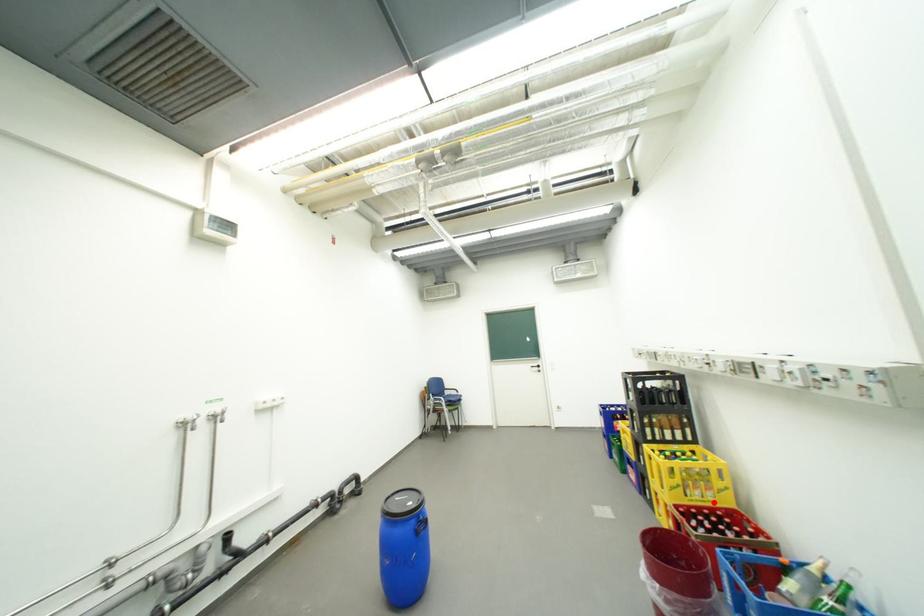
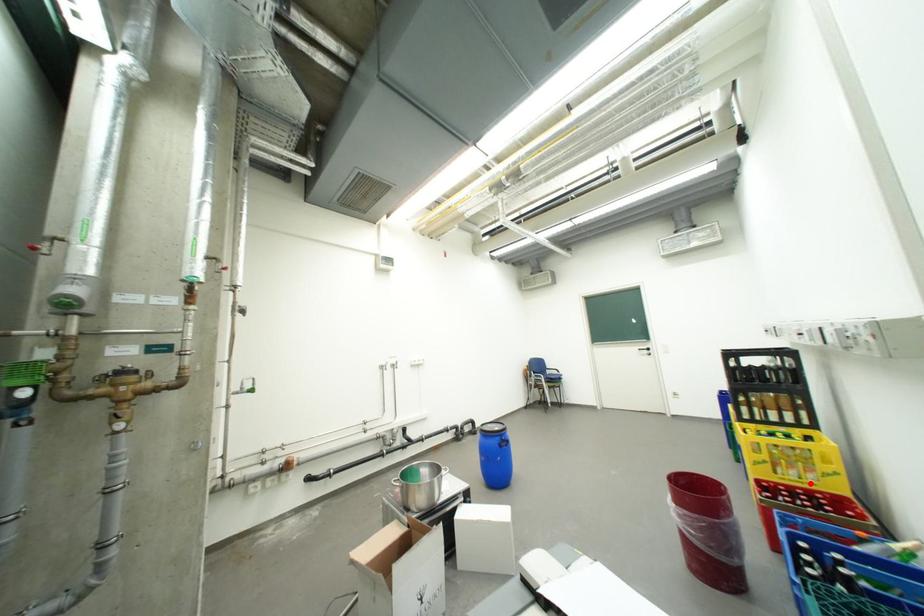
I am providing you with two images of the same scene from different viewpoints. A red point is marked on the first image and another point is marked on the second image. Is the red point in image1 aligned with the point shown in image2?

Yes